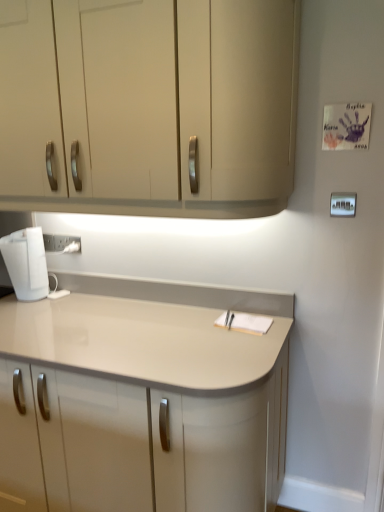
This screenshot has width=384, height=512. In order to click on blank space situated above white glossy kettle at lower left (from a real-world perspective) in this screenshot , I will do `click(23, 231)`.